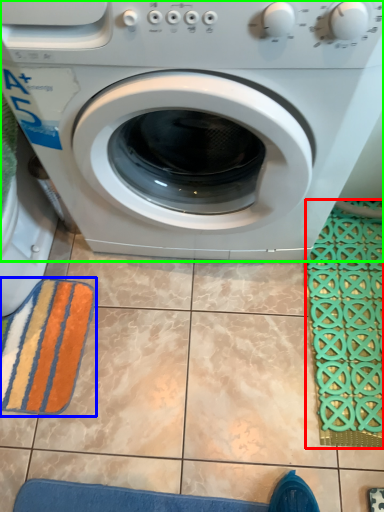
Question: Which object is the closest to the bath mat (highlighted by a red box)? Choose among these: bath towel (highlighted by a blue box) or washing machine (highlighted by a green box).

Choices:
 (A) bath towel
 (B) washing machine

Answer: (B)